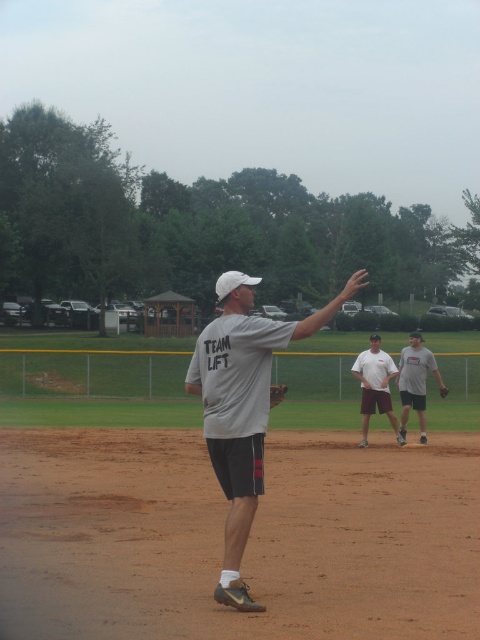
Can you confirm if gray cotton t-shirt at center is smaller than brown leather glove at center?

Yes.

Who is shorter, gray cotton t-shirt at center or brown leather glove at center?

With less height is brown leather glove at center.

Where is `gray cotton t-shirt at center`? The image size is (480, 640). gray cotton t-shirt at center is located at coordinates (415, 381).

Locate an element on the screen. gray cotton t-shirt at center is located at coordinates (415, 381).

Who is shorter, white cotton shirt at center or brown leather glove at center?

brown leather glove at center

Looking at this image, can you confirm if white cotton shirt at center is bigger than brown leather glove at center?

Correct, white cotton shirt at center is larger in size than brown leather glove at center.

Find the location of a particular element. The image size is (480, 640). white cotton shirt at center is located at coordinates (375, 387).

Who is more distant from viewer, (452, 564) or (361, 385)?

Positioned behind is point (361, 385).

Is point (100, 557) behind point (381, 362)?

No.

Is point (321, 502) closer to camera compared to point (394, 428)?

Yes, point (321, 502) is in front of point (394, 428).

The height and width of the screenshot is (640, 480). I want to click on brown dirt field at center, so click(x=249, y=540).